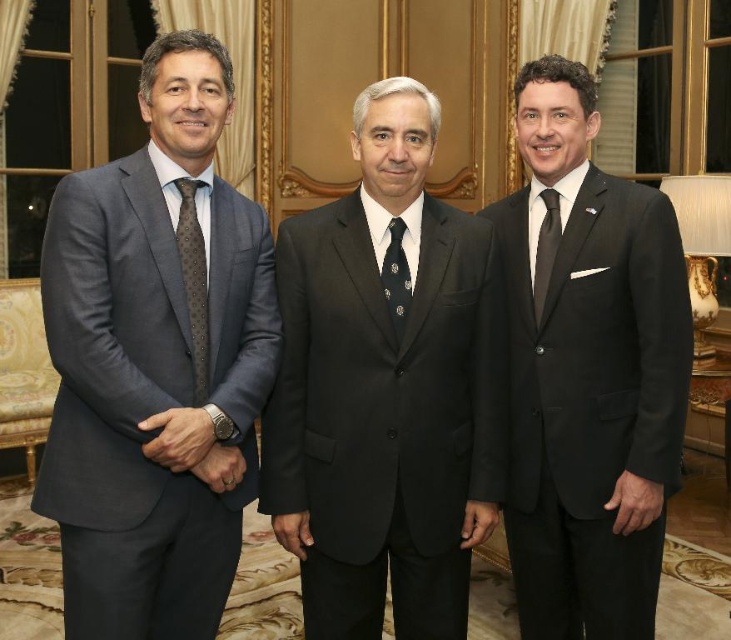
You are standing in the room and want to reach the point marked at coordinates (556, 403). If you take a step forward of 3 feet, will you be closer to the point?

The point is 7.55 feet away. After stepping forward 3 feet, you will be 4.55 feet away, so yes, you will be closer.